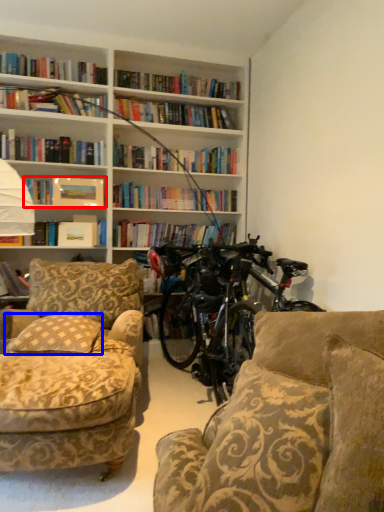
Question: Among these objects, which one is nearest to the camera, book (highlighted by a red box) or pillow (highlighted by a blue box)?

Choices:
 (A) book
 (B) pillow

Answer: (B)